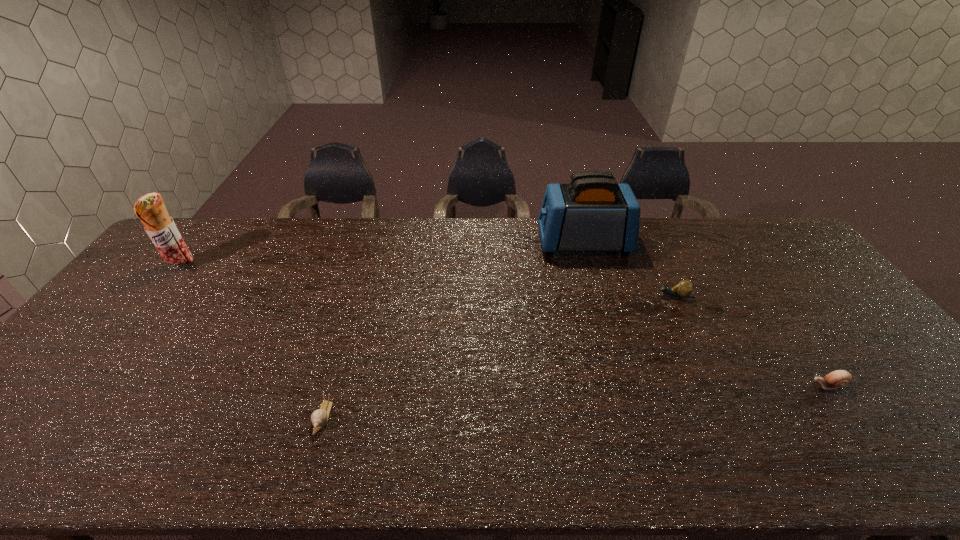
You are a GUI agent. You are given a task and a screenshot of the screen. Output one action in this format:
    pyautogui.click(x=<x>, y=<y>)
    Task: Click on the free space between the toaster and the burrito
    
    Given the screenshot: What is the action you would take?
    pyautogui.click(x=383, y=255)

Locate an element on the screen. This screenshot has width=960, height=540. vacant space that is in between the fourth object from left to right and the third object from left to right is located at coordinates (628, 269).

At what (x,y) coordinates should I click in order to perform the action: click on empty space between the leftmost object and the third object from right to left. Please return your answer as a coordinate pair (x, y). This screenshot has width=960, height=540. Looking at the image, I should click on click(383, 255).

You are a GUI agent. You are given a task and a screenshot of the screen. Output one action in this format:
    pyautogui.click(x=<x>, y=<y>)
    Task: Click on the blank region between the toaster and the rightmost escargot
    This screenshot has height=540, width=960.
    Given the screenshot: What is the action you would take?
    pyautogui.click(x=706, y=314)

You are a GUI agent. You are given a task and a screenshot of the screen. Output one action in this format:
    pyautogui.click(x=<x>, y=<y>)
    Task: Click on the free spot between the fourth farthest object and the burrito
    
    Given the screenshot: What is the action you would take?
    pyautogui.click(x=505, y=326)

Locate an element on the screen. This screenshot has height=540, width=960. empty location between the rightmost object and the shortest object is located at coordinates (575, 401).

Identify which object is located as the second nearest to the second escargot from right to left. Please provide its 2D coordinates. Your answer should be formatted as a tuple, i.e. [(x, y)], where the tuple contains the x and y coordinates of a point satisfying the conditions above.

[(839, 378)]

Identify which object is located as the fourth nearest to the rightmost escargot. Please provide its 2D coordinates. Your answer should be formatted as a tuple, i.e. [(x, y)], where the tuple contains the x and y coordinates of a point satisfying the conditions above.

[(150, 209)]

Where is `escargot object that ranks as the closest to the farthest escargot`? This screenshot has height=540, width=960. escargot object that ranks as the closest to the farthest escargot is located at coordinates (839, 378).

Locate which escargot is the third closest to the toaster. Please provide its 2D coordinates. Your answer should be formatted as a tuple, i.e. [(x, y)], where the tuple contains the x and y coordinates of a point satisfying the conditions above.

[(319, 418)]